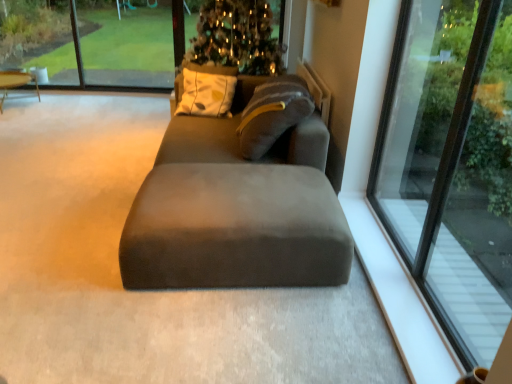
Identify the location of free space in front of suede-like gray studio couch at center. The height and width of the screenshot is (384, 512). (225, 333).